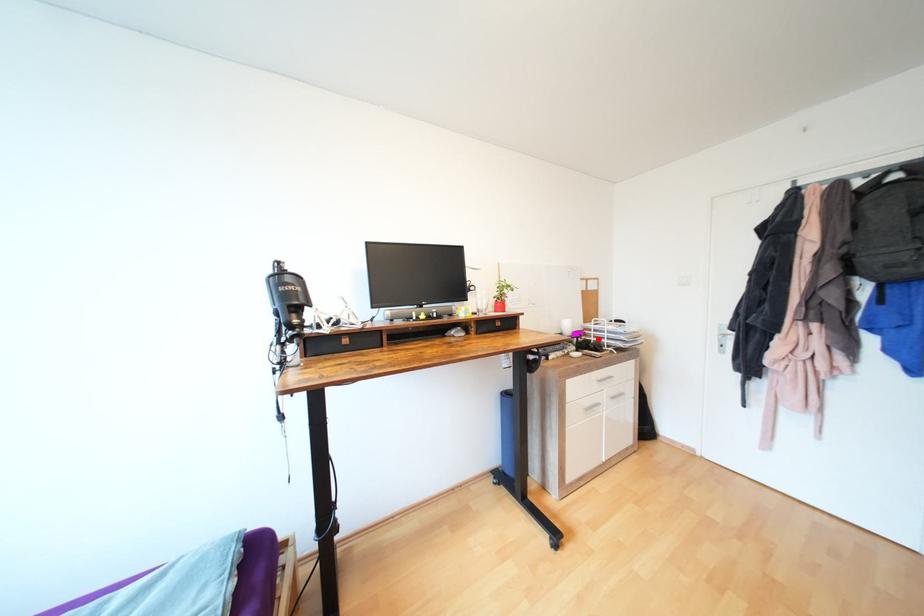
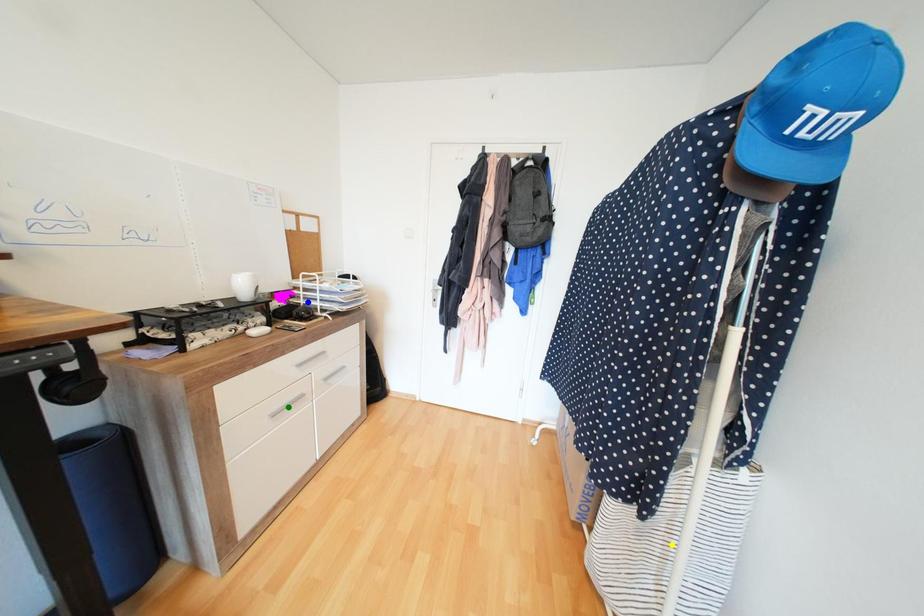
Question: I am providing you with two images of the same scene from different viewpoints. A red point is marked on the first image. You are given multiple points on the second image. Can you choose the point in image 2 that corresponds to the point in image 1?

Choices:
 (A) blue point
 (B) green point
 (C) yellow point

Answer: (A)